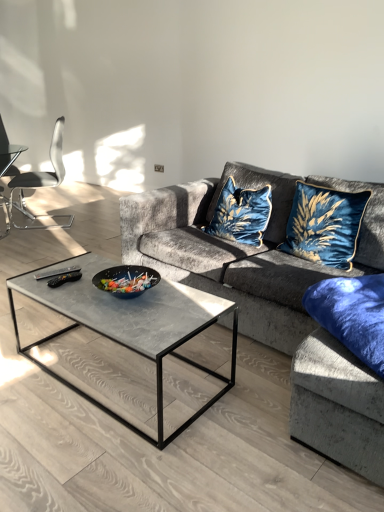
In order to click on vacant area in front of metallic silver chair at left in this screenshot , I will do `click(38, 228)`.